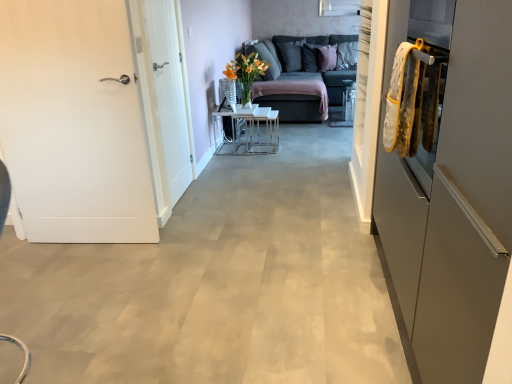
Question: Is point [x=273, y=107] closer or farther from the camera than point [x=459, y=357]?

Choices:
 (A) closer
 (B) farther

Answer: (B)

Question: Is dark gray fabric couch at center wider or thinner than matte gray cabinet at right?

Choices:
 (A) thin
 (B) wide

Answer: (B)

Question: Which object is positioned farthest from the matte gray cabinet at right?

Choices:
 (A) white matte door at left, which is the 1th door from left to right
 (B) dark gray fabric couch at center
 (C) metallic silver table at center
 (D) pink fabric pillow at center, which is the first pillow from right to left
 (E) white wood door at left, arranged as the 2th door when viewed from the left

Answer: (D)

Question: Estimate the real-world distances between objects in this image. Which object is farther from the white wood door at left, arranged as the 2th door when viewed from the left?

Choices:
 (A) matte gray cabinet at right
 (B) white matte door at left, which is the 1th door from left to right
 (C) dark gray fabric couch at center
 (D) pink fabric pillow at center, arranged as the 2th pillow when viewed from the left
 (E) dark gray fabric pillow at upper center, positioned as the first pillow in left-to-right order

Answer: (E)